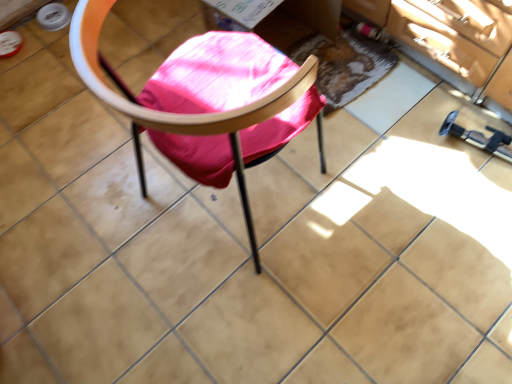
Question: Is textured woolen mat at center smaller than wooden chair at center?

Choices:
 (A) yes
 (B) no

Answer: (A)

Question: From a real-world perspective, is textured woolen mat at center positioned under wooden chair at center based on gravity?

Choices:
 (A) yes
 (B) no

Answer: (A)

Question: Is textured woolen mat at center to the right of wooden chair at center from the viewer's perspective?

Choices:
 (A) yes
 (B) no

Answer: (A)

Question: From the image's perspective, is textured woolen mat at center located above wooden chair at center?

Choices:
 (A) yes
 (B) no

Answer: (A)

Question: Is textured woolen mat at center to the left of wooden chair at center from the viewer's perspective?

Choices:
 (A) no
 (B) yes

Answer: (A)

Question: Would you say wooden chair at center is part of textured woolen mat at center's contents?

Choices:
 (A) yes
 (B) no

Answer: (B)

Question: Is the surface of wooden chair at center in direct contact with textured woolen mat at center?

Choices:
 (A) no
 (B) yes

Answer: (A)

Question: From a real-world perspective, is wooden chair at center on textured woolen mat at center?

Choices:
 (A) no
 (B) yes

Answer: (B)

Question: Is the position of wooden chair at center less distant than that of textured woolen mat at center?

Choices:
 (A) yes
 (B) no

Answer: (A)

Question: Is the depth of wooden chair at center greater than that of textured woolen mat at center?

Choices:
 (A) no
 (B) yes

Answer: (A)

Question: Considering the relative sizes of wooden chair at center and textured woolen mat at center in the image provided, is wooden chair at center wider than textured woolen mat at center?

Choices:
 (A) yes
 (B) no

Answer: (A)

Question: Is wooden chair at center not inside textured woolen mat at center?

Choices:
 (A) yes
 (B) no

Answer: (A)

Question: Considering the positions of wooden chair at center and textured woolen mat at center in the image, is wooden chair at center bigger or smaller than textured woolen mat at center?

Choices:
 (A) small
 (B) big

Answer: (B)